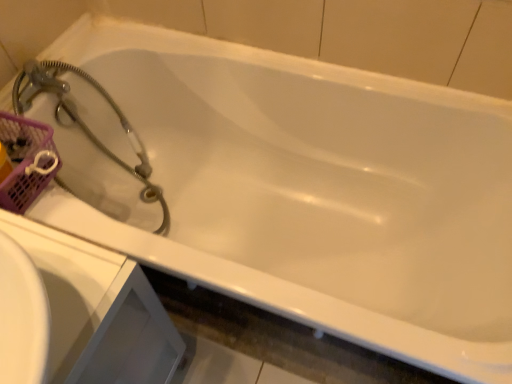
Measure the distance between point (132, 139) and camera.

Point (132, 139) and camera are 4.68 feet apart.

This screenshot has width=512, height=384. I want to click on white glossy sink at lower left, so click(x=98, y=311).

Can you confirm if satin silver hose at upper left is smaller than pink mesh basket at upper left?

No.

Measure the distance between satin silver hose at upper left and pink mesh basket at upper left.

satin silver hose at upper left and pink mesh basket at upper left are 21.51 centimeters apart.

Which is correct: satin silver hose at upper left is inside pink mesh basket at upper left, or outside of it?

satin silver hose at upper left is located beyond the bounds of pink mesh basket at upper left.

Is satin silver hose at upper left next to pink mesh basket at upper left?

No.

Where is `basket located on the left of satin silver hose at upper left`? Image resolution: width=512 pixels, height=384 pixels. basket located on the left of satin silver hose at upper left is located at coordinates (26, 160).

From a real-world perspective, who is located higher, pink mesh basket at upper left or satin silver hose at upper left?

pink mesh basket at upper left, from a real-world perspective.

Which of these two, pink mesh basket at upper left or satin silver hose at upper left, is smaller?

With smaller size is pink mesh basket at upper left.

Relative to satin silver hose at upper left, is pink mesh basket at upper left in front or behind?

pink mesh basket at upper left is in front of satin silver hose at upper left.

Between white glossy sink at lower left and satin silver hose at upper left, which one has smaller width?

white glossy sink at lower left.

Locate an element on the screen. garden hose above the white glossy sink at lower left (from the image's perspective) is located at coordinates (85, 124).

In the scene shown: Considering the relative sizes of white glossy sink at lower left and satin silver hose at upper left in the image provided, is white glossy sink at lower left smaller than satin silver hose at upper left?

Correct, white glossy sink at lower left occupies less space than satin silver hose at upper left.

Between white glossy sink at lower left and satin silver hose at upper left, which one appears on the right side from the viewer's perspective?

Positioned to the right is white glossy sink at lower left.

Considering the positions of objects pink mesh basket at upper left and white glossy sink at lower left in the image provided, who is behind, pink mesh basket at upper left or white glossy sink at lower left?

pink mesh basket at upper left is further from the camera.

Considering the sizes of objects pink mesh basket at upper left and white glossy sink at lower left in the image provided, who is smaller, pink mesh basket at upper left or white glossy sink at lower left?

Smaller between the two is pink mesh basket at upper left.

Is pink mesh basket at upper left outside of white glossy sink at lower left?

Yes.

In terms of height, does white glossy sink at lower left look taller or shorter compared to pink mesh basket at upper left?

white glossy sink at lower left is taller than pink mesh basket at upper left.

In the scene shown: Relative to pink mesh basket at upper left, is white glossy sink at lower left in front or behind?

white glossy sink at lower left is in front of pink mesh basket at upper left.

What are the coordinates of `sink in front of the pink mesh basket at upper left` in the screenshot? It's located at (98, 311).

Considering the relative sizes of white glossy sink at lower left and pink mesh basket at upper left in the image provided, is white glossy sink at lower left smaller than pink mesh basket at upper left?

Incorrect, white glossy sink at lower left is not smaller in size than pink mesh basket at upper left.

Does satin silver hose at upper left lie behind white glossy sink at lower left?

That is True.

Is point (89, 77) more distant than point (42, 238)?

That is True.

Who is shorter, satin silver hose at upper left or white glossy sink at lower left?

Standing shorter between the two is satin silver hose at upper left.

Consider the image. Would you say satin silver hose at upper left is to the left or to the right of white glossy sink at lower left in the picture?

satin silver hose at upper left is positioned on white glossy sink at lower left's left side.

The height and width of the screenshot is (384, 512). Identify the location of garden hose lying above the pink mesh basket at upper left (from the image's perspective). (85, 124).

This screenshot has height=384, width=512. Identify the location of garden hose on the right of pink mesh basket at upper left. (85, 124).

Consider the image. Looking at the image, which one is located closer to satin silver hose at upper left, pink mesh basket at upper left or white glossy sink at lower left?

The object closer to satin silver hose at upper left is pink mesh basket at upper left.

When comparing their distances from pink mesh basket at upper left, does satin silver hose at upper left or white glossy sink at lower left seem closer?

Based on the image, satin silver hose at upper left appears to be nearer to pink mesh basket at upper left.

In the scene shown: Looking at the image, which one is located further to satin silver hose at upper left, white glossy sink at lower left or pink mesh basket at upper left?

white glossy sink at lower left is positioned further to the anchor satin silver hose at upper left.

From the image, which object appears to be nearer to white glossy sink at lower left, satin silver hose at upper left or pink mesh basket at upper left?

Among the two, pink mesh basket at upper left is located nearer to white glossy sink at lower left.

Based on their spatial positions, is pink mesh basket at upper left or satin silver hose at upper left closer to white glossy sink at lower left?

Based on the image, pink mesh basket at upper left appears to be nearer to white glossy sink at lower left.

When comparing their distances from pink mesh basket at upper left, does white glossy sink at lower left or satin silver hose at upper left seem closer?

satin silver hose at upper left lies closer to pink mesh basket at upper left than the other object.

Identify the location of basket between satin silver hose at upper left and white glossy sink at lower left from top to bottom. This screenshot has height=384, width=512. (26, 160).